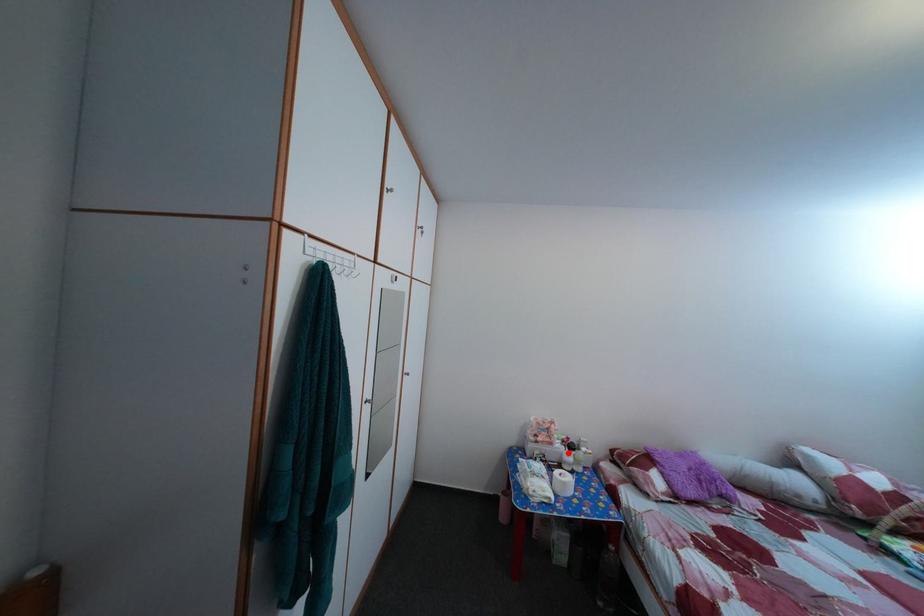
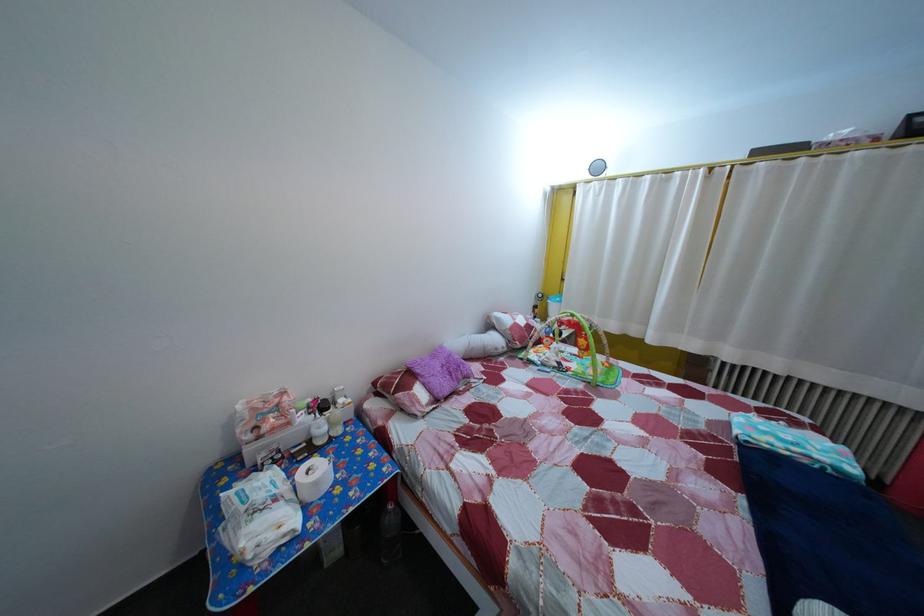
Question: I am providing you with two images of the same scene from different viewpoints. In image1, a red point is highlighted. Considering the same 3D point in image2, which of the following is correct?

Choices:
 (A) It is closer
 (B) It is farther

Answer: (A)